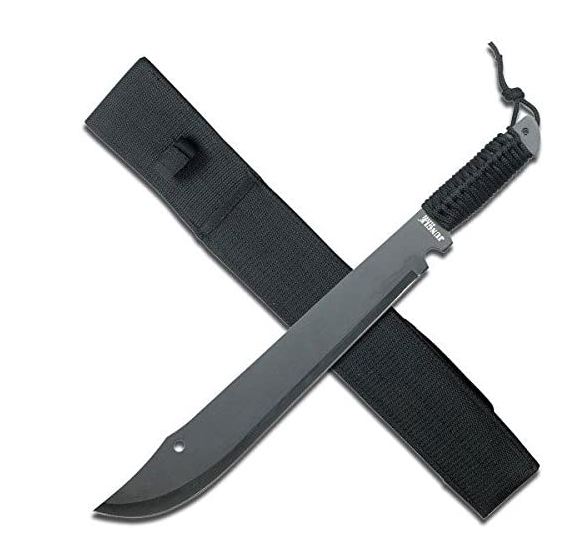
The image size is (584, 553). I want to click on knife holder, so click(x=409, y=356).